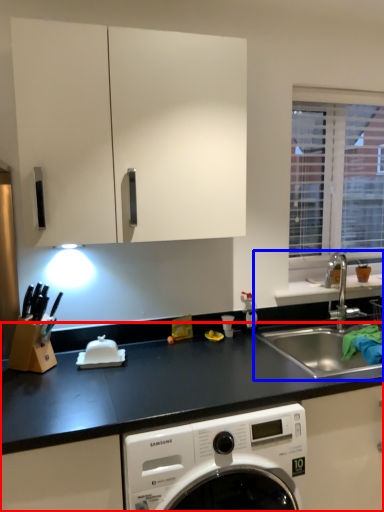
Question: Which point is closer to the camera, countertop (highlighted by a red box) or sink (highlighted by a blue box)?

Choices:
 (A) countertop
 (B) sink

Answer: (A)